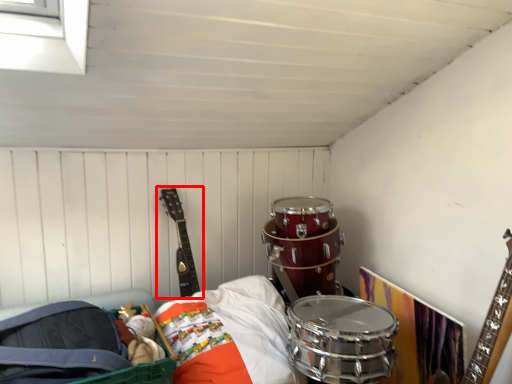
Question: From the image's perspective, where is guitar (annotated by the red box) located in relation to drum in the image?

Choices:
 (A) below
 (B) above

Answer: (B)